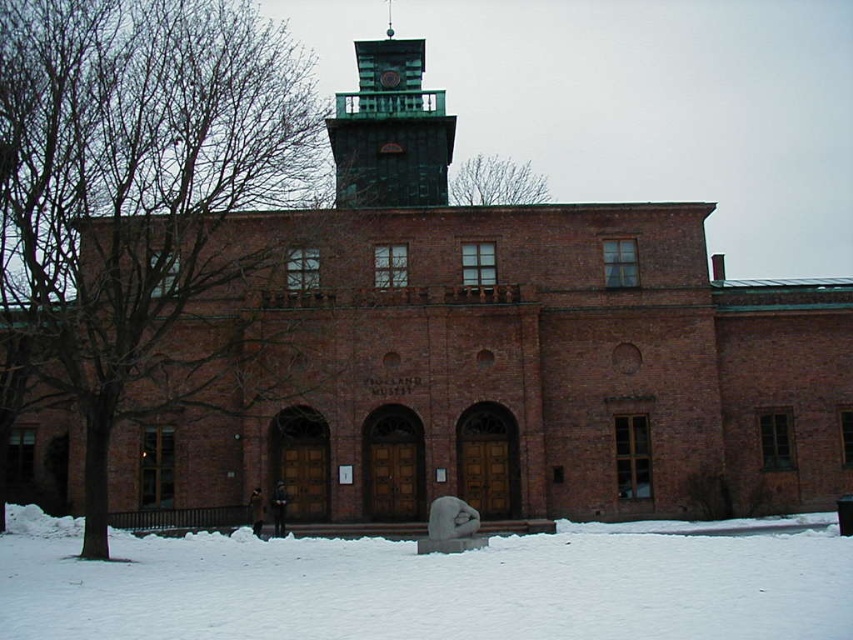
Question: Which object is closer to the camera taking this photo?

Choices:
 (A) brown bark tree at left
 (B) white powdery snow at lower center

Answer: (B)

Question: Which point appears farthest from the camera in this image?

Choices:
 (A) (676, 541)
 (B) (480, 202)
 (C) (392, 122)

Answer: (B)

Question: Is brown bark tree at left further to the viewer compared to green patina metal clock tower at upper center?

Choices:
 (A) no
 (B) yes

Answer: (A)

Question: Considering the real-world distances, which object is closest to the bare branches at upper center?

Choices:
 (A) green patina metal clock tower at upper center
 (B) white powdery snow at lower center
 (C) brown bark tree at left

Answer: (A)

Question: Can you confirm if brown bark tree at left is positioned to the right of white powdery snow at lower center?

Choices:
 (A) no
 (B) yes

Answer: (A)

Question: In this image, where is brown bark tree at left located relative to bare branches at upper center?

Choices:
 (A) below
 (B) above

Answer: (A)